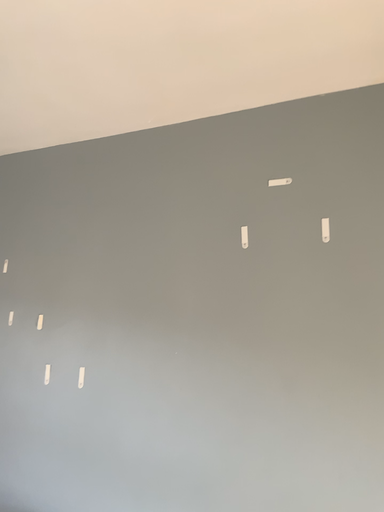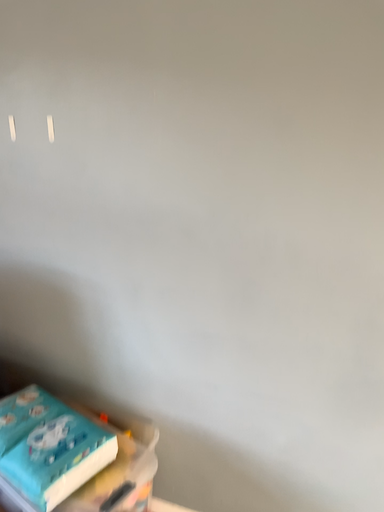
Question: Which way did the camera rotate in the video?

Choices:
 (A) rotated downward
 (B) rotated upward

Answer: (A)